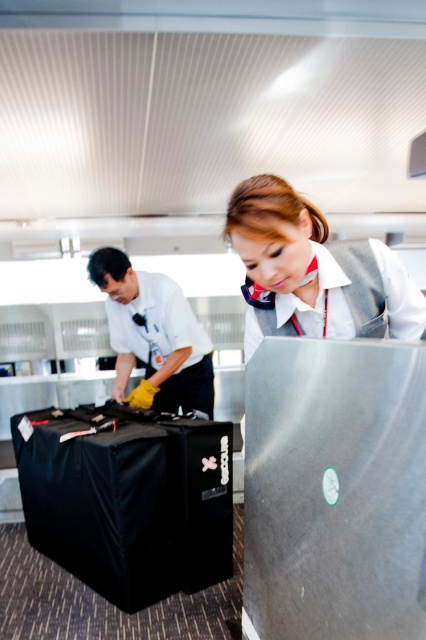
Question: Which point appears closest to the camera in this image?

Choices:
 (A) (305, 221)
 (B) (115, 340)

Answer: (A)

Question: Which object appears closest to the camera in this image?

Choices:
 (A) yellow rubber gloves at left
 (B) gray fabric vest at center

Answer: (B)

Question: In this image, where is gray fabric vest at center located relative to yellow rubber gloves at left?

Choices:
 (A) below
 (B) above

Answer: (B)

Question: From the image, what is the correct spatial relationship of gray fabric vest at center in relation to yellow rubber gloves at left?

Choices:
 (A) above
 (B) below

Answer: (A)

Question: Is gray fabric vest at center to the left of yellow rubber gloves at left from the viewer's perspective?

Choices:
 (A) yes
 (B) no

Answer: (B)

Question: Which point is farther to the camera?

Choices:
 (A) gray fabric vest at center
 (B) yellow rubber gloves at left

Answer: (B)